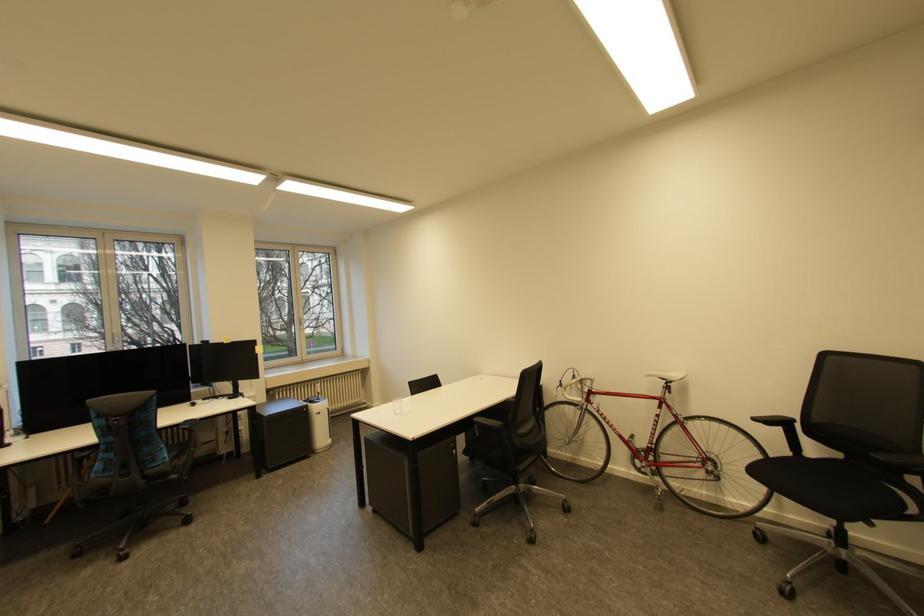
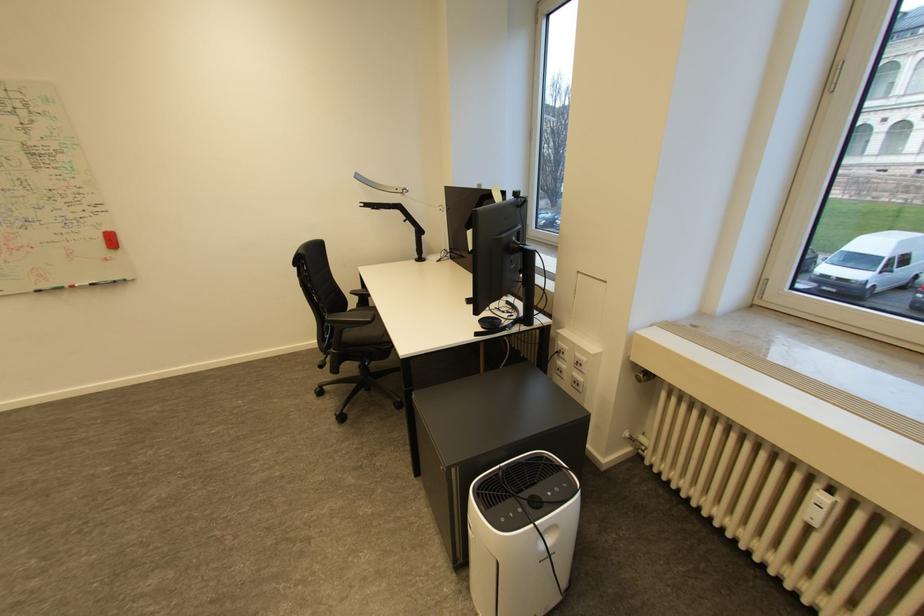
Locate, in the second image, the point that corresponds to [325,394] in the first image.

(816, 525)